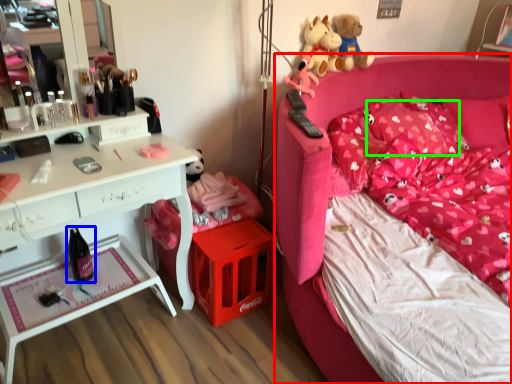
Question: Estimate the real-world distances between objects in this image. Which object is farther from bed (highlighted by a red box), wine bottle (highlighted by a blue box) or pillow (highlighted by a green box)?

Choices:
 (A) wine bottle
 (B) pillow

Answer: (A)